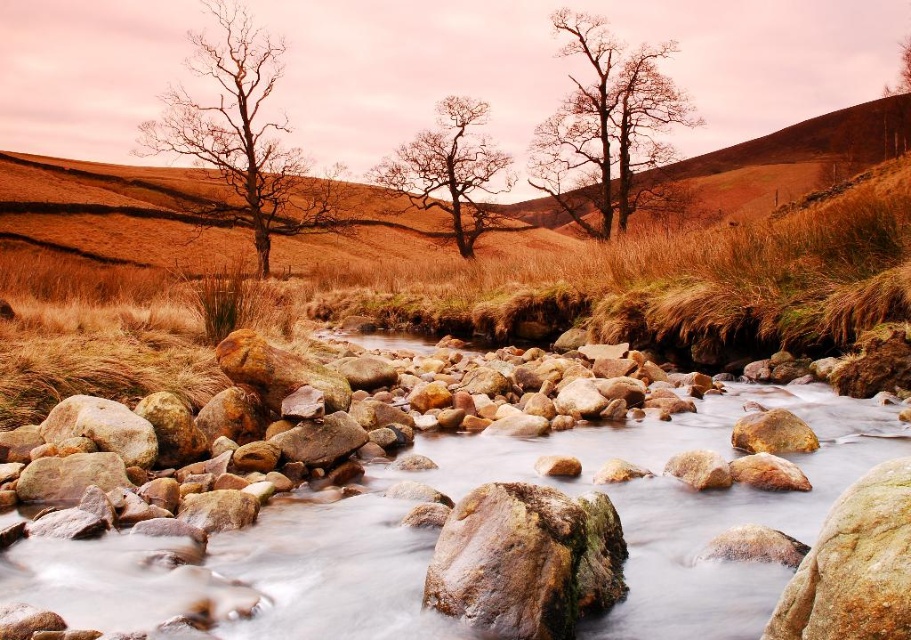
Question: Which point appears closest to the camera in this image?

Choices:
 (A) (288, 508)
 (B) (259, 68)

Answer: (A)

Question: Which of the following is the farthest from the observer?

Choices:
 (A) (407, 188)
 (B) (230, 180)
 (C) (260, 636)
 (D) (637, 157)

Answer: (A)

Question: Does brown textured rocks at center appear on the right side of bare wood tree at upper center?

Choices:
 (A) no
 (B) yes

Answer: (A)

Question: Is bare wood tree at upper center smaller than smooth bark tree at center?

Choices:
 (A) no
 (B) yes

Answer: (A)

Question: Observing the image, what is the correct spatial positioning of brown textured rocks at center in reference to bare branches at left?

Choices:
 (A) below
 (B) above

Answer: (A)

Question: Estimate the real-world distances between objects in this image. Which object is farther from the bare wood tree at upper center?

Choices:
 (A) brown textured rocks at center
 (B) smooth bark tree at center

Answer: (A)